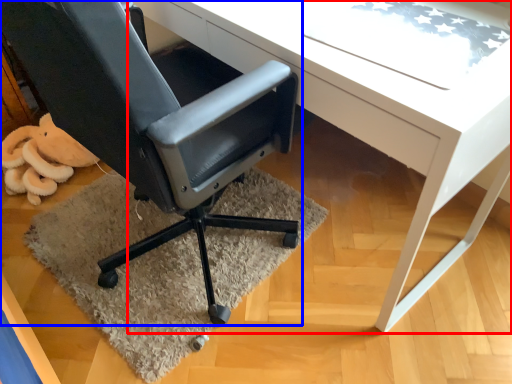
Question: Which object is further to the camera taking this photo, desk (highlighted by a red box) or chair (highlighted by a blue box)?

Choices:
 (A) desk
 (B) chair

Answer: (A)